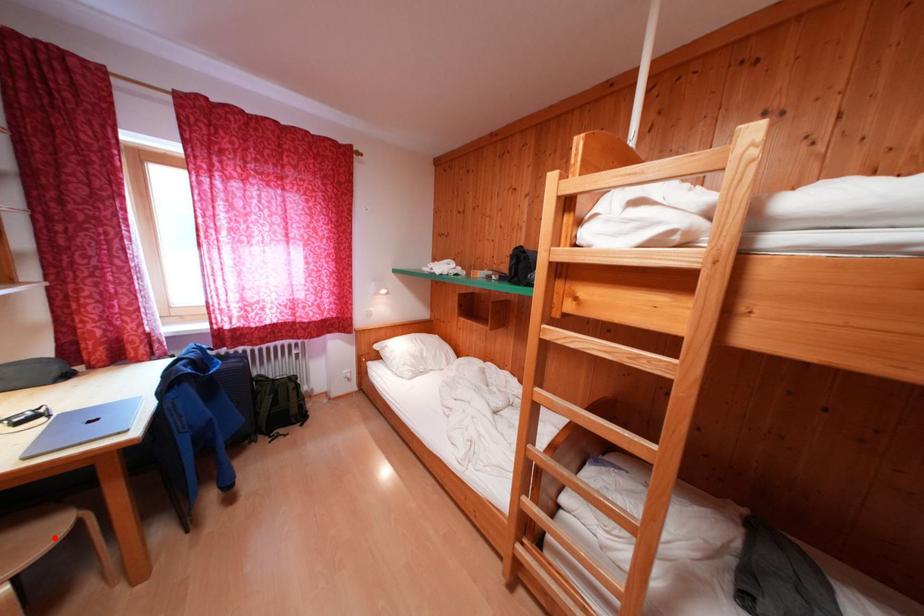
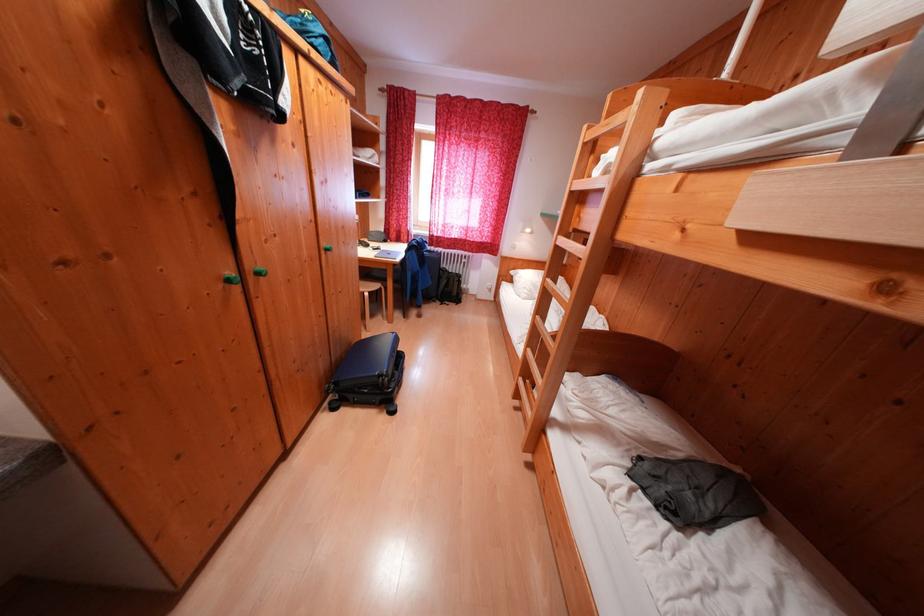
Question: A red point is marked in image1. In image2, is the corresponding 3D point closer to the camera or farther? Reply with the corresponding letter.

Choices:
 (A) The corresponding 3D point is closer.
 (B) The corresponding 3D point is farther.

Answer: (A)